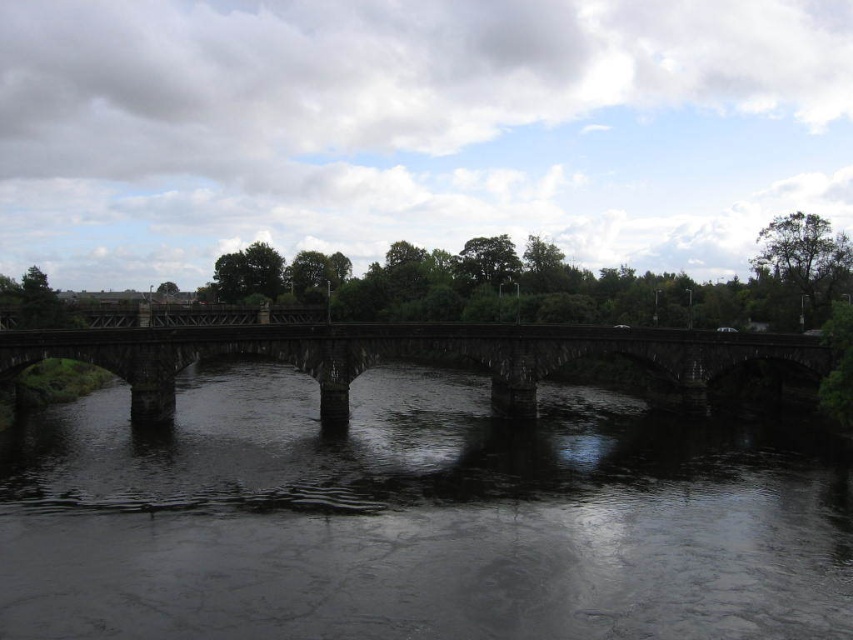
Question: Which point is farther to the camera?

Choices:
 (A) (416, 400)
 (B) (691, 349)

Answer: (A)

Question: Which of the following is the closest to the observer?

Choices:
 (A) dark stone bridge at center
 (B) dark gray stone bridge at center

Answer: (B)

Question: Which object is farther from the camera taking this photo?

Choices:
 (A) dark stone bridge at center
 (B) dark gray stone bridge at center

Answer: (A)

Question: Does dark gray stone bridge at center appear on the left side of dark stone bridge at center?

Choices:
 (A) no
 (B) yes

Answer: (A)

Question: In this image, where is dark gray stone bridge at center located relative to dark stone bridge at center?

Choices:
 (A) above
 (B) below

Answer: (B)

Question: Can you confirm if dark gray stone bridge at center is bigger than dark stone bridge at center?

Choices:
 (A) no
 (B) yes

Answer: (A)